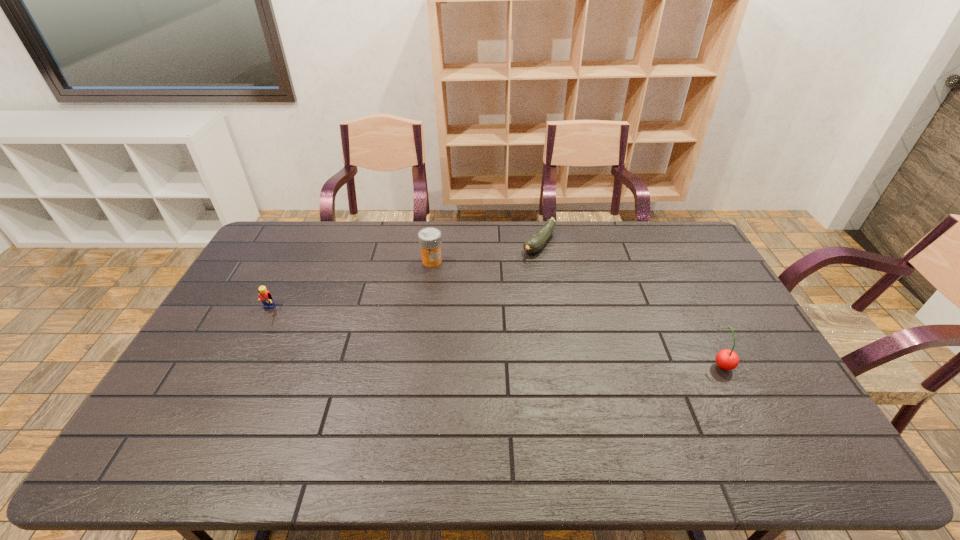
You are a GUI agent. You are given a task and a screenshot of the screen. Output one action in this format:
    pyautogui.click(x=<x>, y=<y>)
    Task: Click on the blank space located 0.380m at the blossom end of the shortest object
    The height and width of the screenshot is (540, 960).
    Given the screenshot: What is the action you would take?
    pyautogui.click(x=467, y=318)

You are a GUI agent. You are given a task and a screenshot of the screen. Output one action in this format:
    pyautogui.click(x=<x>, y=<y>)
    Task: Click on the blank area located at the blossom end of the shortest object
    This screenshot has width=960, height=540.
    Given the screenshot: What is the action you would take?
    click(x=474, y=310)

What are the coordinates of `free space located 0.140m on the label side of the medicine` in the screenshot? It's located at (427, 295).

Find the location of a particular element. The height and width of the screenshot is (540, 960). vacant point located on the label side of the medicine is located at coordinates (424, 321).

Find the location of `free space located on the label side of the medicine`. free space located on the label side of the medicine is located at coordinates (430, 277).

Identify the location of zucchini that is at the far edge. (535, 242).

The width and height of the screenshot is (960, 540). What are the coordinates of `medicine located at the far edge` in the screenshot? It's located at (430, 241).

I want to click on object positioned at the left edge, so click(x=266, y=298).

Locate an element on the screen. The image size is (960, 540). object at the right edge is located at coordinates (726, 359).

You are a GUI agent. You are given a task and a screenshot of the screen. Output one action in this format:
    pyautogui.click(x=<x>, y=<y>)
    Task: Click on the vacant area at the far edge of the desktop
    
    Given the screenshot: What is the action you would take?
    pyautogui.click(x=397, y=242)